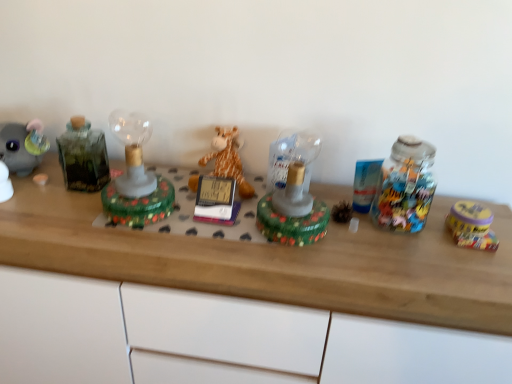
Locate an element on the screen. Image resolution: width=512 pixels, height=384 pixels. vacant area that lies in front of green glass bottle at left is located at coordinates (57, 216).